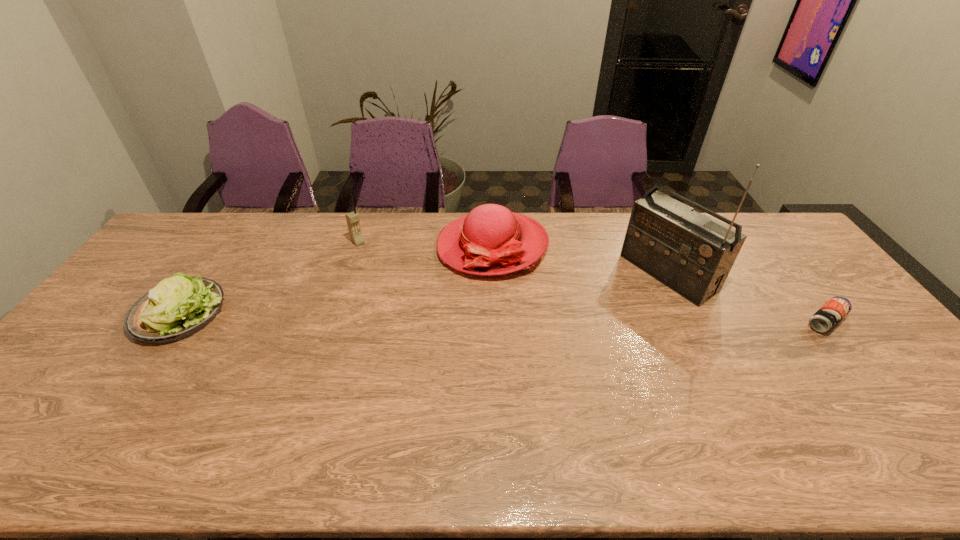
Locate an element on the screen. The image size is (960, 540). vacant space at the far left corner is located at coordinates (202, 227).

Where is `free space at the far right corner of the desktop`? The height and width of the screenshot is (540, 960). free space at the far right corner of the desktop is located at coordinates (745, 231).

In order to click on free spot at the near right corner of the desktop in this screenshot , I will do `click(909, 395)`.

In order to click on vacant area between the leftmost object and the second object from left to right in this screenshot , I will do `click(270, 278)`.

You are a GUI agent. You are given a task and a screenshot of the screen. Output one action in this format:
    pyautogui.click(x=<x>, y=<y>)
    Task: Click on the vacant area that lies between the fourth object from left to right and the third shortest object
    
    Given the screenshot: What is the action you would take?
    pyautogui.click(x=580, y=259)

Where is `free area in between the third object from right to left and the fourth object from left to right`? This screenshot has width=960, height=540. free area in between the third object from right to left and the fourth object from left to right is located at coordinates click(580, 259).

The image size is (960, 540). In order to click on vacant area that lies between the beer can and the second object from right to left in this screenshot , I will do `click(747, 297)`.

In order to click on object that is the second nearest to the shortest object in this screenshot , I will do `click(491, 240)`.

Where is `object that is the third closest one to the hat`? This screenshot has height=540, width=960. object that is the third closest one to the hat is located at coordinates (178, 307).